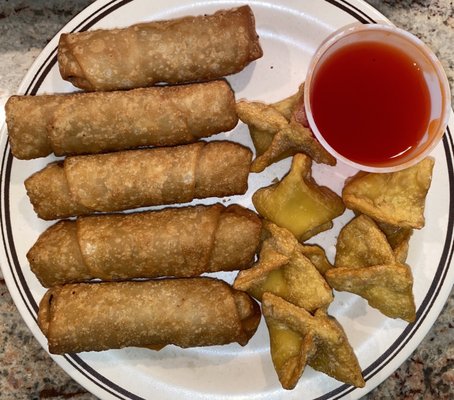
The image size is (454, 400). In order to click on gray marbled counter top surface in this screenshot , I will do `click(37, 375)`, `click(432, 370)`, `click(22, 25)`, `click(422, 13)`.